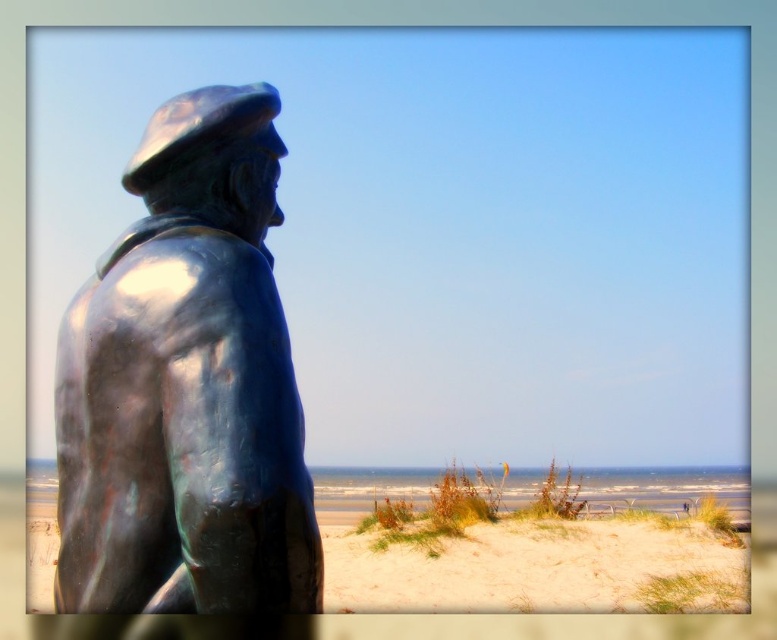
Question: Does bronze statue at left appear on the right side of sandy beige sand at lower right?

Choices:
 (A) yes
 (B) no

Answer: (B)

Question: Is bronze statue at left further to camera compared to sandy beige sand at lower right?

Choices:
 (A) yes
 (B) no

Answer: (B)

Question: Can you confirm if bronze statue at left is positioned below sandy beige sand at lower right?

Choices:
 (A) yes
 (B) no

Answer: (B)

Question: Which of the following is the farthest from the observer?

Choices:
 (A) (701, 600)
 (B) (183, 467)

Answer: (A)

Question: Which point is farther from the camera taking this photo?

Choices:
 (A) (152, 529)
 (B) (702, 584)

Answer: (B)